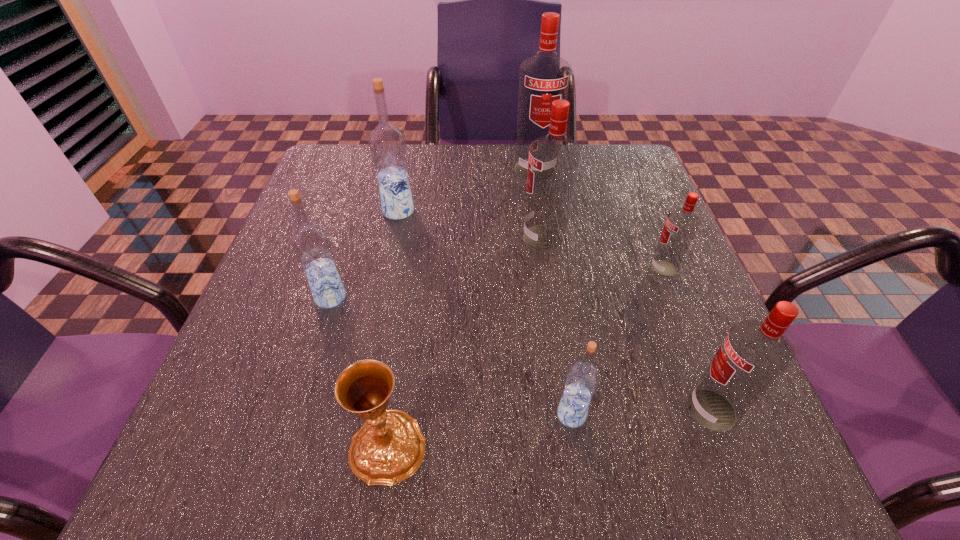
Find the location of a particular element. The width and height of the screenshot is (960, 540). the farthest red vodka is located at coordinates (544, 77).

You are a GUI agent. You are given a task and a screenshot of the screen. Output one action in this format:
    pyautogui.click(x=<x>, y=<y>)
    Task: Click on the biggest red vodka
    The image size is (960, 540).
    Given the screenshot: What is the action you would take?
    pyautogui.click(x=544, y=77)

Where is `the farthest blue vodka`? the farthest blue vodka is located at coordinates (387, 143).

At what (x,y) coordinates should I click in order to perform the action: click on the second blue vodka from left to right. Please return your answer as a coordinate pair (x, y). The width and height of the screenshot is (960, 540). Looking at the image, I should click on coord(387,143).

The width and height of the screenshot is (960, 540). Find the location of `the third farthest vodka`. the third farthest vodka is located at coordinates (553, 161).

At what (x,y) coordinates should I click in order to perform the action: click on the sixth nearest object. Please return your answer as a coordinate pair (x, y). The width and height of the screenshot is (960, 540). Looking at the image, I should click on (553, 161).

Locate an element on the screen. The image size is (960, 540). the second smallest blue vodka is located at coordinates (311, 244).

In order to click on the leftmost object in this screenshot , I will do `click(311, 244)`.

At what (x,y) coordinates should I click in order to perform the action: click on the second smallest red vodka. Please return your answer as a coordinate pair (x, y). This screenshot has height=540, width=960. Looking at the image, I should click on (754, 354).

Locate an element on the screen. the fourth farthest vodka is located at coordinates (681, 225).